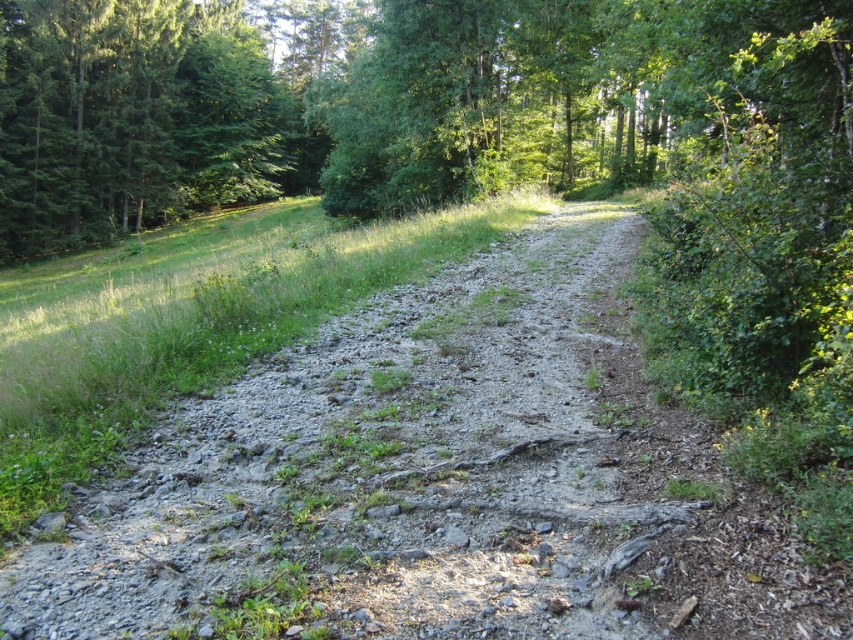
Question: Which object is closer to the camera taking this photo?

Choices:
 (A) green leafy tree at center
 (B) gray gravel path at center

Answer: (B)

Question: Observing the image, what is the correct spatial positioning of gray gravel path at center in reference to green leafy tree at center?

Choices:
 (A) below
 (B) above

Answer: (A)

Question: Which of the following is the closest to the observer?

Choices:
 (A) green leafy tree at center
 (B) gray gravel path at center

Answer: (B)

Question: Is gray gravel path at center below green leafy tree at center?

Choices:
 (A) yes
 (B) no

Answer: (A)

Question: Does gray gravel path at center have a greater width compared to green leafy tree at center?

Choices:
 (A) no
 (B) yes

Answer: (A)